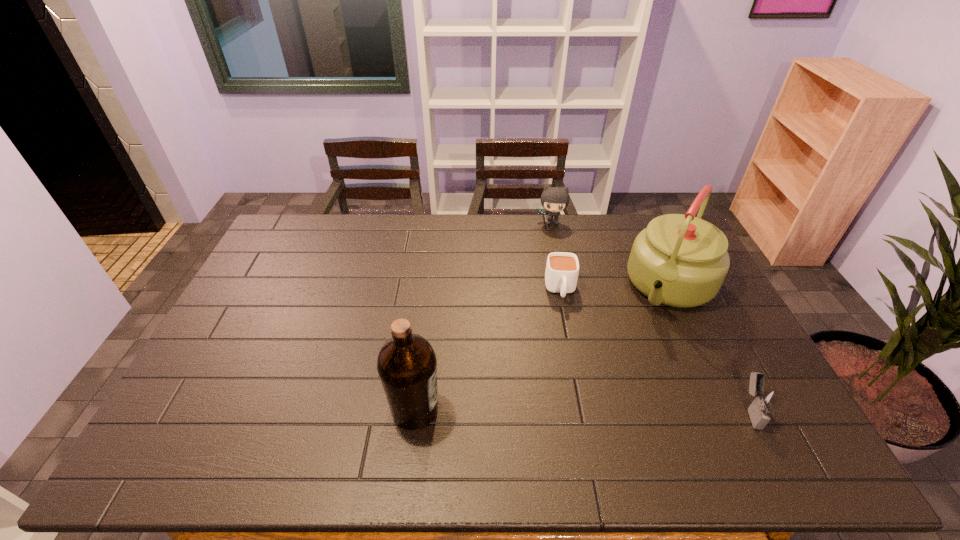
At what (x,y) coordinates should I click in order to perform the action: click on olive oil. Please return your answer as a coordinate pair (x, y). The height and width of the screenshot is (540, 960). Looking at the image, I should click on (407, 365).

At what (x,y) coordinates should I click in order to perform the action: click on the fourth tallest object. Please return your answer as a coordinate pair (x, y). The height and width of the screenshot is (540, 960). Looking at the image, I should click on (765, 400).

I want to click on cup, so pyautogui.click(x=562, y=269).

The height and width of the screenshot is (540, 960). Identify the location of kettle. (679, 260).

The image size is (960, 540). I want to click on the third shortest object, so coord(554,199).

Where is `the farthest object`? This screenshot has height=540, width=960. the farthest object is located at coordinates [554, 199].

Find the location of a particular element. The image size is (960, 540). vacant space situated 0.310m on the label of the olive oil is located at coordinates (563, 409).

The width and height of the screenshot is (960, 540). What are the coordinates of `free space located 0.270m on the left of the igniter` in the screenshot? It's located at (630, 409).

I want to click on vacant space located on the side with the handle of the shortest object, so click(574, 401).

Where is `free location located 0.110m on the side with the handle of the shortest object`? The width and height of the screenshot is (960, 540). free location located 0.110m on the side with the handle of the shortest object is located at coordinates (566, 333).